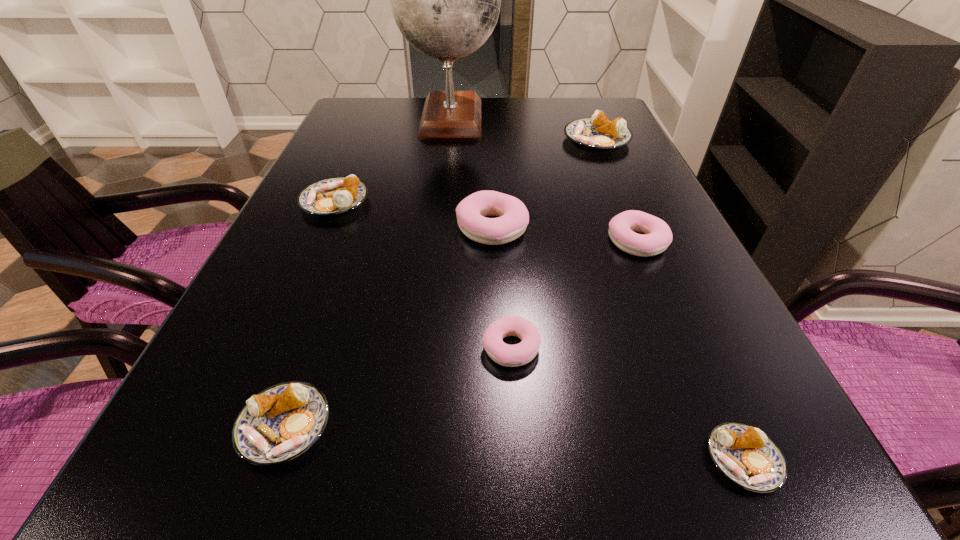
Where is `free spot located at the equator of the globe`? free spot located at the equator of the globe is located at coordinates (582, 117).

The width and height of the screenshot is (960, 540). I want to click on free space located 0.170m on the front of the biggest brown pastry, so click(x=618, y=191).

Locate an element on the screen. The image size is (960, 540). vacant space located 0.220m on the left of the biggest pink pastry is located at coordinates (348, 228).

Locate an element on the screen. This screenshot has height=540, width=960. free space located 0.340m on the front of the second farthest brown pastry is located at coordinates (270, 353).

Where is `vacant region located on the back of the rightmost pink pastry`? The width and height of the screenshot is (960, 540). vacant region located on the back of the rightmost pink pastry is located at coordinates 619,198.

Identify the location of vacant space situated 0.360m on the back of the second smallest brown pastry. The height and width of the screenshot is (540, 960). (351, 234).

At what (x,y) coordinates should I click in order to perform the action: click on free space located 0.120m on the right of the nearest pink pastry. Please return your answer as a coordinate pair (x, y). This screenshot has height=540, width=960. Looking at the image, I should click on (617, 347).

I want to click on vacant area located 0.050m on the left of the smallest brown pastry, so click(x=668, y=460).

Image resolution: width=960 pixels, height=540 pixels. Identify the location of globe at the far edge. (446, 0).

Identify the location of pastry situated at the far edge. The height and width of the screenshot is (540, 960). (599, 133).